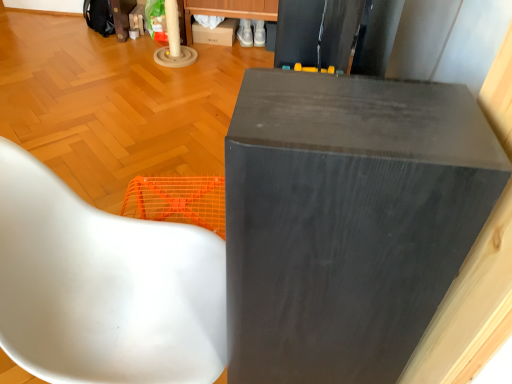
Question: From a real-world perspective, is matte black speaker at upper center positioned above or below matte cardboard box at upper center?

Choices:
 (A) below
 (B) above

Answer: (B)

Question: Considering the positions of matte black speaker at upper center and matte cardboard box at upper center in the image, is matte black speaker at upper center taller or shorter than matte cardboard box at upper center?

Choices:
 (A) short
 (B) tall

Answer: (B)

Question: Which object is positioned closest to the matte cardboard box at upper center?

Choices:
 (A) matte black speaker at upper center
 (B) white glossy chair at lower left

Answer: (B)

Question: Which of these objects is positioned closest to the matte black speaker at upper center?

Choices:
 (A) matte cardboard box at upper center
 (B) white glossy chair at lower left

Answer: (B)